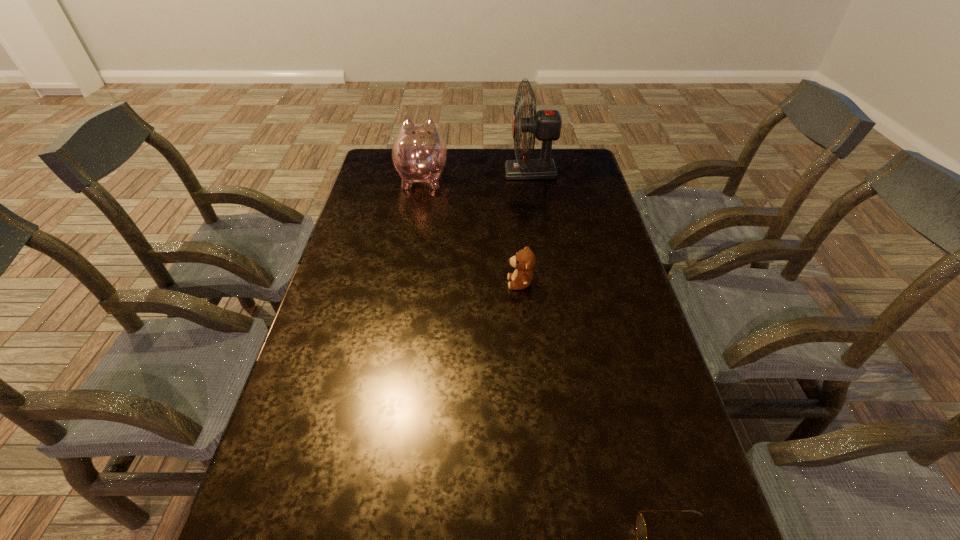
You are a GUI agent. You are given a task and a screenshot of the screen. Output one action in this format:
    pyautogui.click(x=<x>, y=<y>)
    Task: Click on the unoccupied position between the tallest object and the third farthest object
    
    Given the screenshot: What is the action you would take?
    pyautogui.click(x=525, y=228)

Where is `vacant region between the third shortest object and the fan`? The image size is (960, 540). vacant region between the third shortest object and the fan is located at coordinates (476, 175).

Image resolution: width=960 pixels, height=540 pixels. I want to click on free point between the second shortest object and the tallest object, so click(525, 228).

Select which object is the closest to the third shortest object. Please provide its 2D coordinates. Your answer should be formatted as a tuple, i.e. [(x, y)], where the tuple contains the x and y coordinates of a point satisfying the conditions above.

[(545, 125)]

The image size is (960, 540). What are the coordinates of `object identified as the second closest to the third farthest object` in the screenshot? It's located at (419, 154).